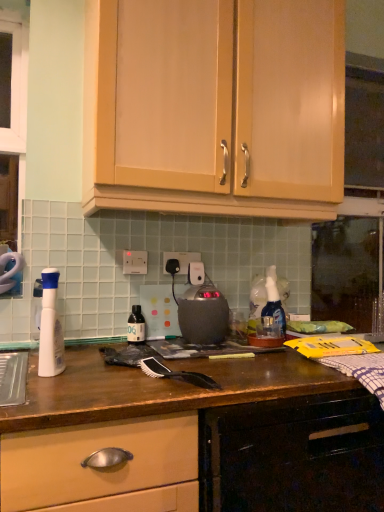
Question: Is wooden drawer at lower left, marked as the second cabinetry in a top-to-bottom arrangement, closer to camera compared to black synthetic brush at center?

Choices:
 (A) no
 (B) yes

Answer: (B)

Question: Does wooden drawer at lower left, the 1th cabinetry when ordered from bottom to top, turn towards black synthetic brush at center?

Choices:
 (A) no
 (B) yes

Answer: (A)

Question: Is wooden drawer at lower left, marked as the second cabinetry in a top-to-bottom arrangement, thinner than black synthetic brush at center?

Choices:
 (A) yes
 (B) no

Answer: (B)

Question: Can you confirm if wooden drawer at lower left, marked as the second cabinetry in a top-to-bottom arrangement, is positioned to the right of black synthetic brush at center?

Choices:
 (A) no
 (B) yes

Answer: (B)

Question: Is wooden drawer at lower left, marked as the second cabinetry in a top-to-bottom arrangement, with black synthetic brush at center?

Choices:
 (A) no
 (B) yes

Answer: (A)

Question: Considering the positions of matte wood cabinets at upper center, which is the 1th cabinetry from top to bottom, and black synthetic brush at center in the image, is matte wood cabinets at upper center, which is the 1th cabinetry from top to bottom, wider or thinner than black synthetic brush at center?

Choices:
 (A) wide
 (B) thin

Answer: (A)

Question: From the image's perspective, is matte wood cabinets at upper center, which is the 1th cabinetry from top to bottom, located above or below black synthetic brush at center?

Choices:
 (A) below
 (B) above

Answer: (B)

Question: Is matte wood cabinets at upper center, the 2th cabinetry when ordered from bottom to top, taller or shorter than black synthetic brush at center?

Choices:
 (A) short
 (B) tall

Answer: (B)

Question: Is matte wood cabinets at upper center, which is the 1th cabinetry from top to bottom, inside the boundaries of black synthetic brush at center, or outside?

Choices:
 (A) inside
 (B) outside

Answer: (B)

Question: From a real-world perspective, is black synthetic brush at center above or below white plastic spray bottle at left?

Choices:
 (A) below
 (B) above

Answer: (A)

Question: Is black synthetic brush at center to the left or to the right of white plastic spray bottle at left in the image?

Choices:
 (A) left
 (B) right

Answer: (B)

Question: Is black synthetic brush at center bigger or smaller than white plastic spray bottle at left?

Choices:
 (A) small
 (B) big

Answer: (A)

Question: Does point (150, 365) appear closer or farther from the camera than point (51, 323)?

Choices:
 (A) farther
 (B) closer

Answer: (A)

Question: From a real-world perspective, is satin black kettle at center above or below black plastic electric outlet at center, which appears as the 1th electric outlet when viewed from the right?

Choices:
 (A) below
 (B) above

Answer: (A)

Question: Considering the relative positions of satin black kettle at center and black plastic electric outlet at center, which is the first electric outlet from back to front, in the image provided, is satin black kettle at center to the left or to the right of black plastic electric outlet at center, which is the first electric outlet from back to front,?

Choices:
 (A) left
 (B) right

Answer: (B)